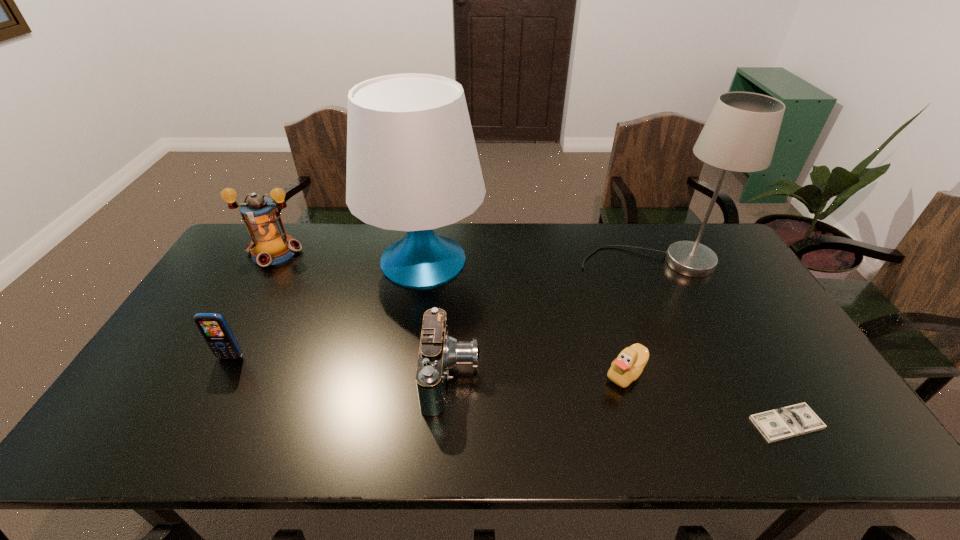
Locate an element on the screen. vacant space located on the screen of the cellular telephone is located at coordinates (187, 438).

This screenshot has width=960, height=540. I want to click on vacant space situated on the front-facing side of the camcorder, so click(526, 376).

The image size is (960, 540). In order to click on blank area located 0.180m at the beak of the second shortest object in this screenshot , I will do `click(535, 373)`.

Image resolution: width=960 pixels, height=540 pixels. Find the location of `free region located 0.160m at the beak of the second shortest object`. free region located 0.160m at the beak of the second shortest object is located at coordinates coord(542,373).

The width and height of the screenshot is (960, 540). What are the coordinates of `free space located 0.390m at the beak of the second shortest object` in the screenshot? It's located at (453, 373).

This screenshot has width=960, height=540. Find the location of `vacant space situated 0.380m on the back of the dollar`. vacant space situated 0.380m on the back of the dollar is located at coordinates (713, 296).

Identify the location of lantern at the far edge. (270, 244).

Where is `camcorder that is at the near edge`? camcorder that is at the near edge is located at coordinates (439, 352).

Where is `dollar present at the near edge`? dollar present at the near edge is located at coordinates (778, 424).

Where is `lantern that is at the left edge`? lantern that is at the left edge is located at coordinates (270, 244).